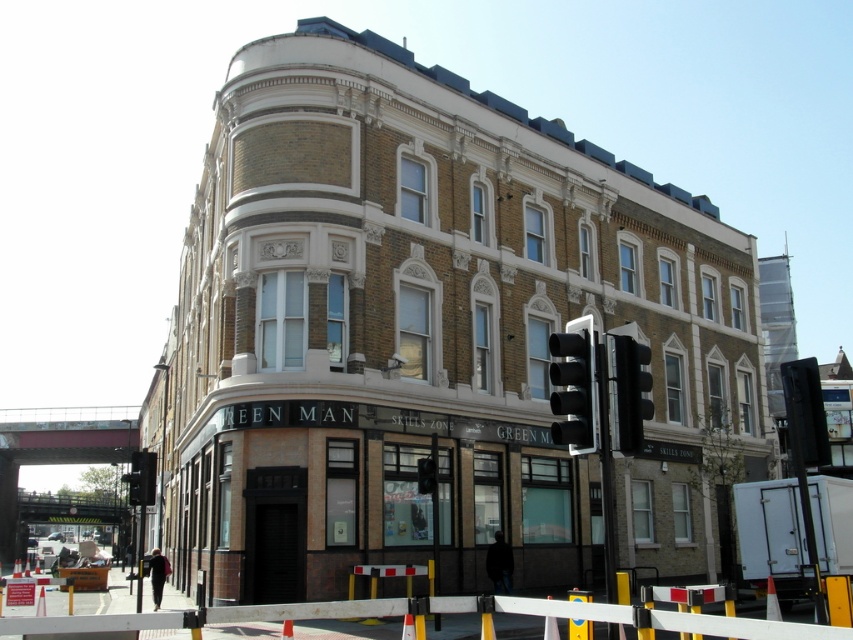
From the picture: You are a delivery driver who needs to park your vehicle near the entrance of Green Man business. You see two traffic lights at the right side of the road. Which traffic light, the black glass traffic light at right or the black plastic traffic light at right, is smaller in size?

The black glass traffic light at right is smaller in size compared to the black plastic traffic light at right, so the black glass traffic light at right is the smaller one.

You are a delivery driver needing to park your truck near the building. The parking area is between the black glass traffic light at right and the black plastic traffic light at lower left. Which traffic light is shorter and should you avoid parking too close to prevent blocking the view?

The black glass traffic light at right is shorter than the black plastic traffic light at lower left. To avoid blocking the view, you should park farther away from the shorter traffic light.

You are a pedestrian standing at the entrance of Green Man Skills Zone. You see a black plastic traffic light at right and a black plastic barricade at lower center. Which object is positioned further to the right?

The black plastic traffic light at right is positioned further to the right than the black plastic barricade at lower center.